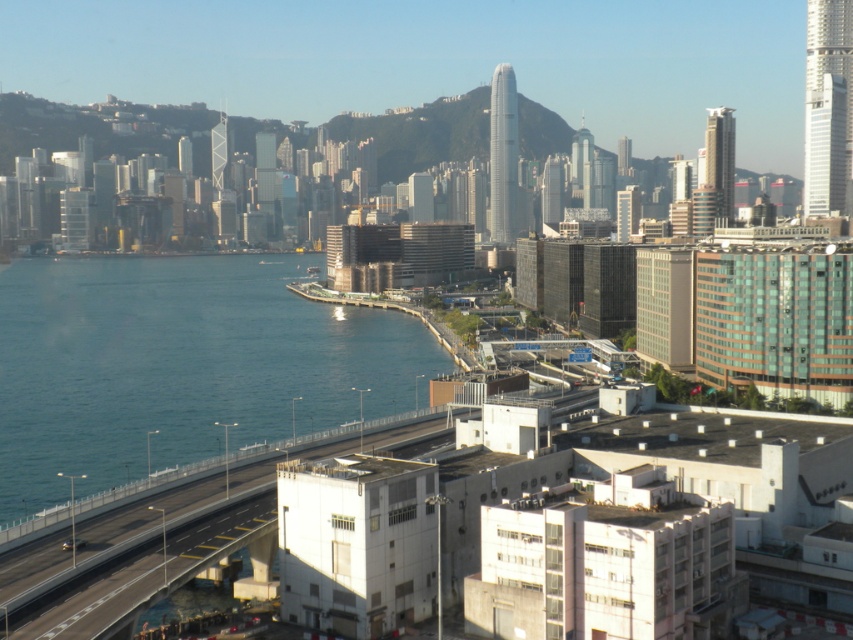
Question: From the image, what is the correct spatial relationship of blue water at lower left in relation to concrete bridge at lower center?

Choices:
 (A) left
 (B) right

Answer: (A)

Question: Which object appears closest to the camera in this image?

Choices:
 (A) concrete bridge at lower center
 (B) blue water at lower left

Answer: (A)

Question: Does blue water at lower left appear on the left side of concrete bridge at lower center?

Choices:
 (A) no
 (B) yes

Answer: (B)

Question: Is blue water at lower left positioned behind concrete bridge at lower center?

Choices:
 (A) no
 (B) yes

Answer: (B)

Question: Which point appears farthest from the camera in this image?

Choices:
 (A) (80, 628)
 (B) (28, 472)

Answer: (B)

Question: Among these objects, which one is farthest from the camera?

Choices:
 (A) blue water at lower left
 (B) concrete bridge at lower center

Answer: (A)